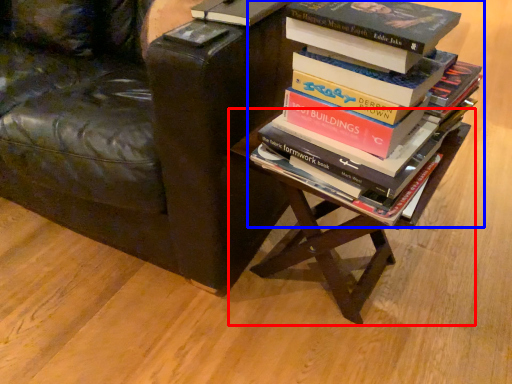
Question: Which object is further to the camera taking this photo, table (highlighted by a red box) or book (highlighted by a blue box)?

Choices:
 (A) table
 (B) book

Answer: (A)